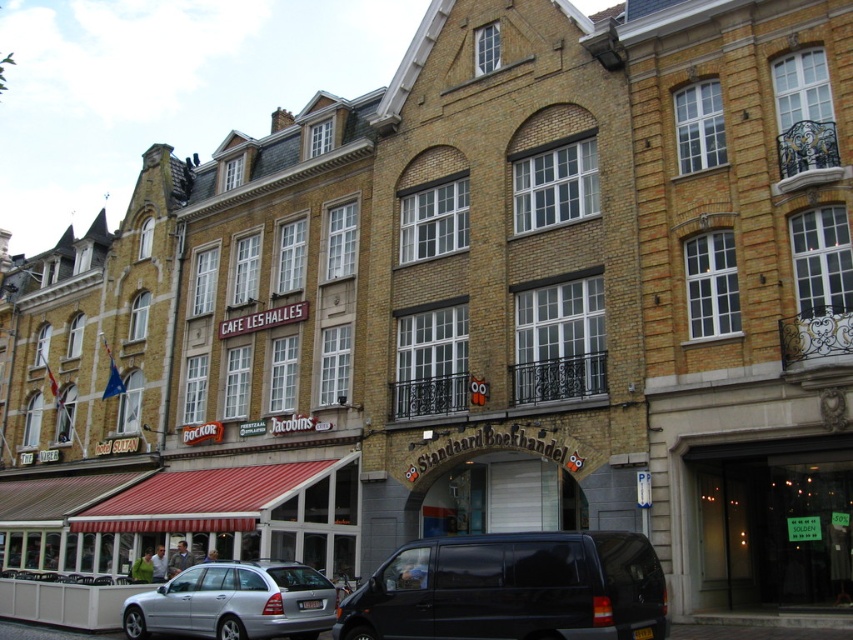
Question: Does black matte van at center have a smaller size compared to silver metallic car at center?

Choices:
 (A) yes
 (B) no

Answer: (B)

Question: Which object appears farthest from the camera in this image?

Choices:
 (A) black matte van at center
 (B) silver metallic car at center

Answer: (B)

Question: Which point is closer to the camera?

Choices:
 (A) black matte van at center
 (B) silver metallic car at center

Answer: (A)

Question: Does black matte van at center appear on the right side of silver metallic car at center?

Choices:
 (A) no
 (B) yes

Answer: (B)

Question: Considering the relative positions of black matte van at center and silver metallic car at center in the image provided, where is black matte van at center located with respect to silver metallic car at center?

Choices:
 (A) above
 (B) below

Answer: (A)